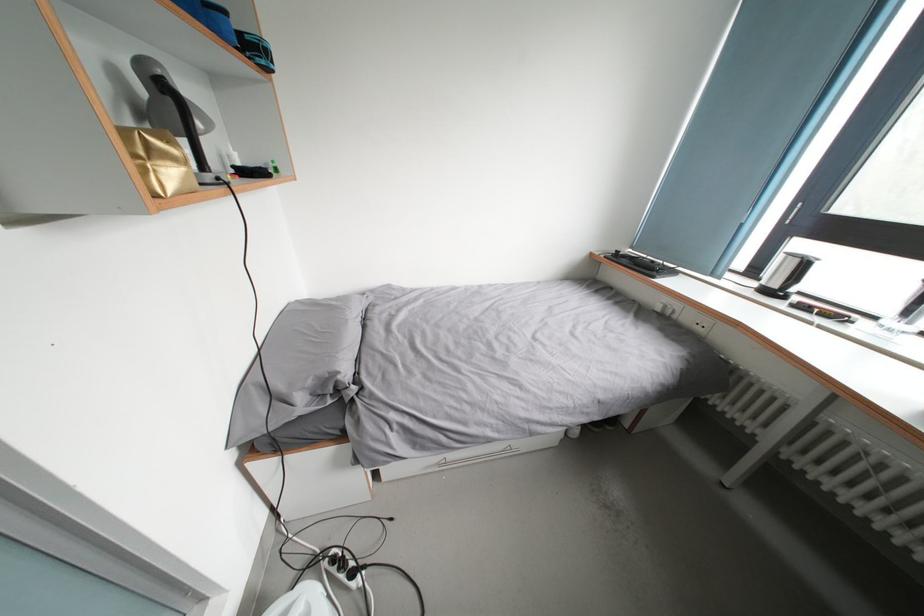
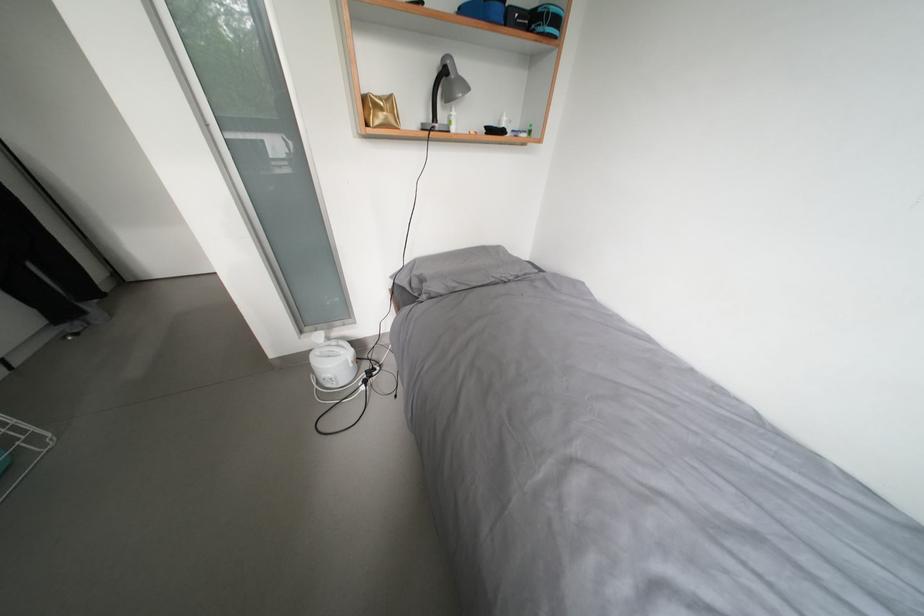
The images are taken continuously from a first-person perspective. In which direction is your viewpoint rotating?

The camera rotated toward left-down.